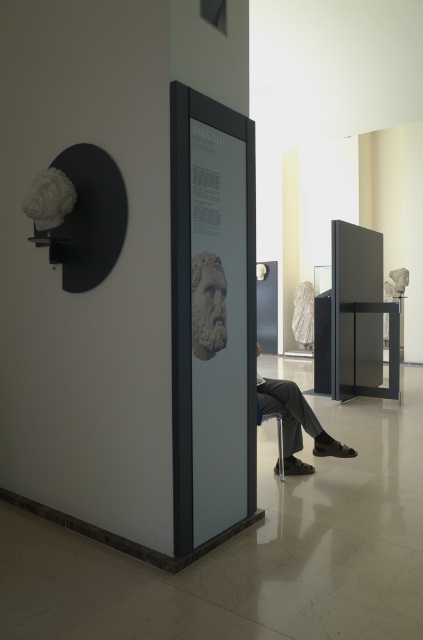
Question: Is the position of white marble bust at center less distant than that of metallic silver chair at lower center?

Choices:
 (A) yes
 (B) no

Answer: (A)

Question: Which is nearer to the white marble bust at center?

Choices:
 (A) dark gray fabric pants at lower center
 (B) metallic silver chair at lower center

Answer: (B)

Question: Can you confirm if dark gray fabric pants at lower center is thinner than white marble bust at center?

Choices:
 (A) no
 (B) yes

Answer: (A)

Question: Which point appears farthest from the camera in this image?

Choices:
 (A) (288, 460)
 (B) (197, 340)

Answer: (A)

Question: Considering the relative positions of dark gray fabric pants at lower center and white marble bust at center in the image provided, where is dark gray fabric pants at lower center located with respect to white marble bust at center?

Choices:
 (A) above
 (B) below

Answer: (B)

Question: Among these points, which one is farthest from the camera?

Choices:
 (A) (198, 276)
 (B) (277, 442)
 (C) (329, 444)

Answer: (B)